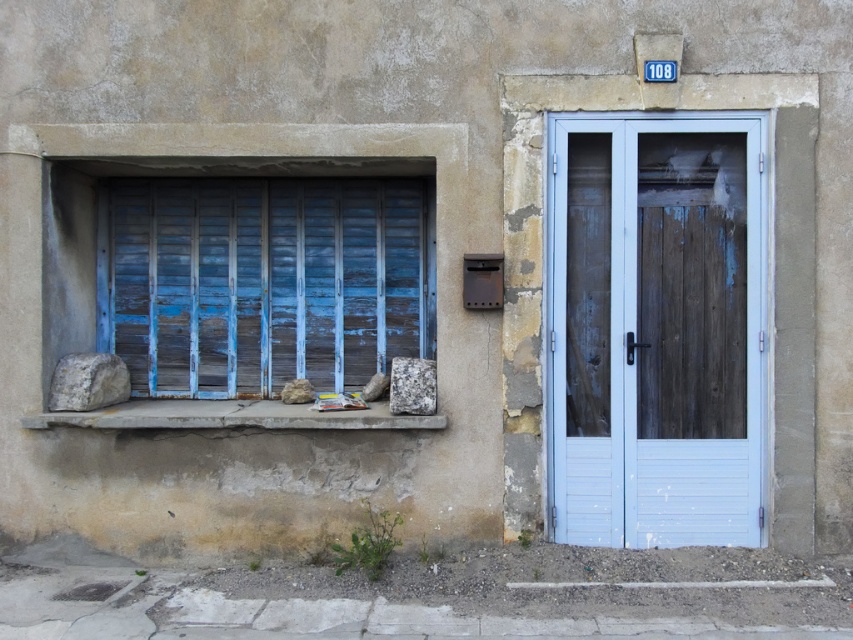
You are a window cleaner standing at the base of the building. You notice the rusty concrete window sill at lower center and the granite rock at lower center. Which object is positioned to the left when viewed from your perspective?

The rusty concrete window sill at lower center is positioned to the left of the granite rock at lower center from your perspective.

You are a delivery person trying to deliver a package to the building. You notice the light blue wood door at center and the gray rough rock at lower left. Which object is wider?

The light blue wood door at center might be wider than gray rough rock at lower left.

You are a window cleaner with a 36 inch ladder. You need to reach both the blue wooden shutters at left and the granite rock at lower center. Can your ladder reach both locations from the same spot?

The blue wooden shutters at left and the granite rock at lower center are 35.35 inches apart. Since the ladder is 36 inches long, it can reach both locations from the same spot as the distance between them is less than the ladder length.